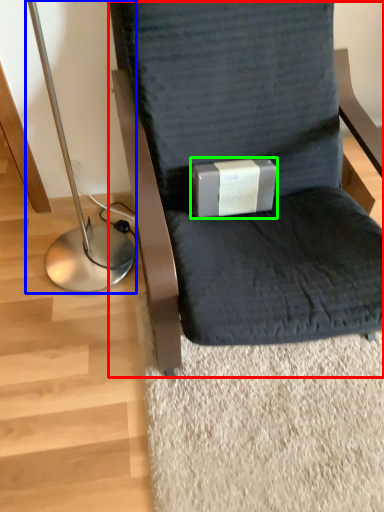
Question: Which object is the closest to the chair (highlighted by a red box)? Choose among these: bedside lamp (highlighted by a blue box) or box (highlighted by a green box).

Choices:
 (A) bedside lamp
 (B) box

Answer: (B)